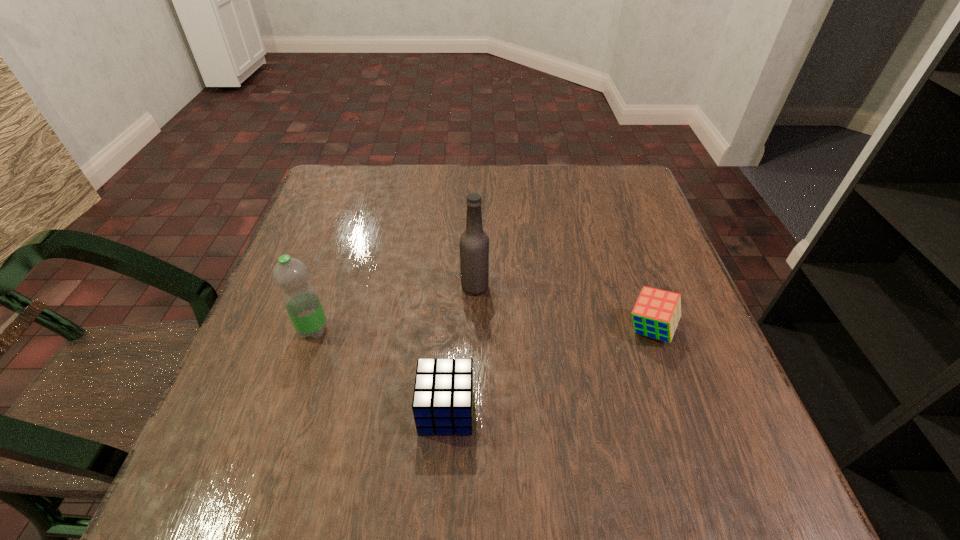
The height and width of the screenshot is (540, 960). What are the coordinates of `vacant space located 0.100m on the back of the farther cube` in the screenshot? It's located at coord(632,275).

Where is `vacant point located 0.320m on the right of the nearer cube`? The width and height of the screenshot is (960, 540). vacant point located 0.320m on the right of the nearer cube is located at coordinates (671, 410).

Find the location of `object situated at the left edge`. object situated at the left edge is located at coordinates (301, 301).

Find the location of `object located in the right edge section of the desktop`. object located in the right edge section of the desktop is located at coordinates (656, 314).

Where is `vacant space at the far edge`? vacant space at the far edge is located at coordinates (549, 188).

In the image, there is a desktop. Where is `vacant space at the left edge`? vacant space at the left edge is located at coordinates (299, 249).

I want to click on vacant space at the right edge of the desktop, so click(682, 287).

What are the coordinates of `free space at the far left corner of the desktop` in the screenshot? It's located at (342, 193).

The height and width of the screenshot is (540, 960). In order to click on blank space at the near left corner of the desktop in this screenshot , I will do `click(227, 491)`.

The image size is (960, 540). I want to click on free space at the far right corner, so click(x=582, y=167).